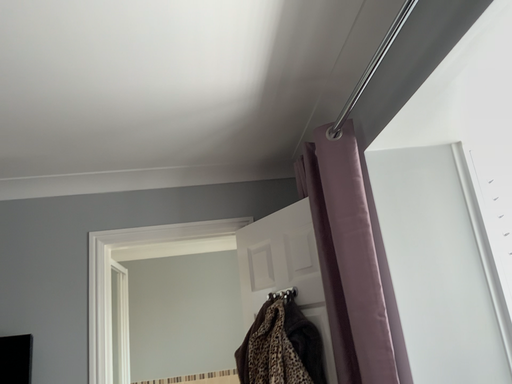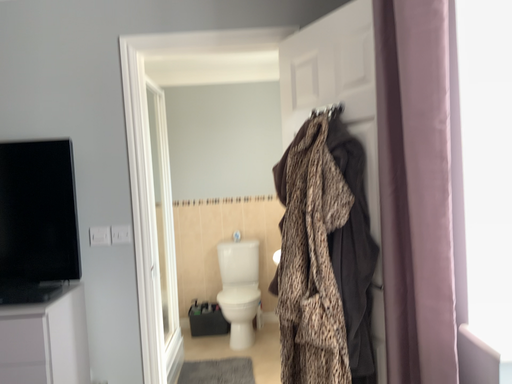
Question: Which way did the camera rotate in the video?

Choices:
 (A) rotated downward
 (B) rotated upward

Answer: (A)